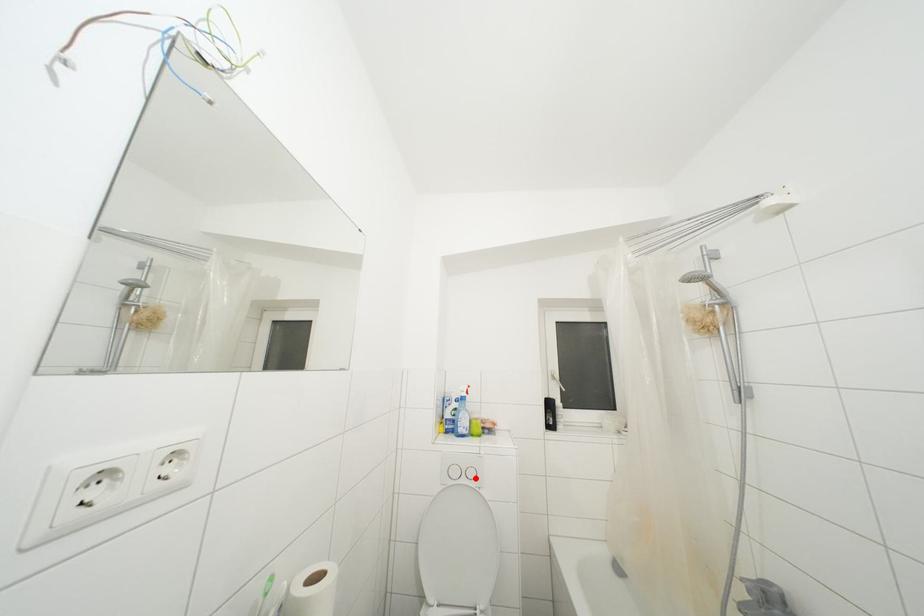
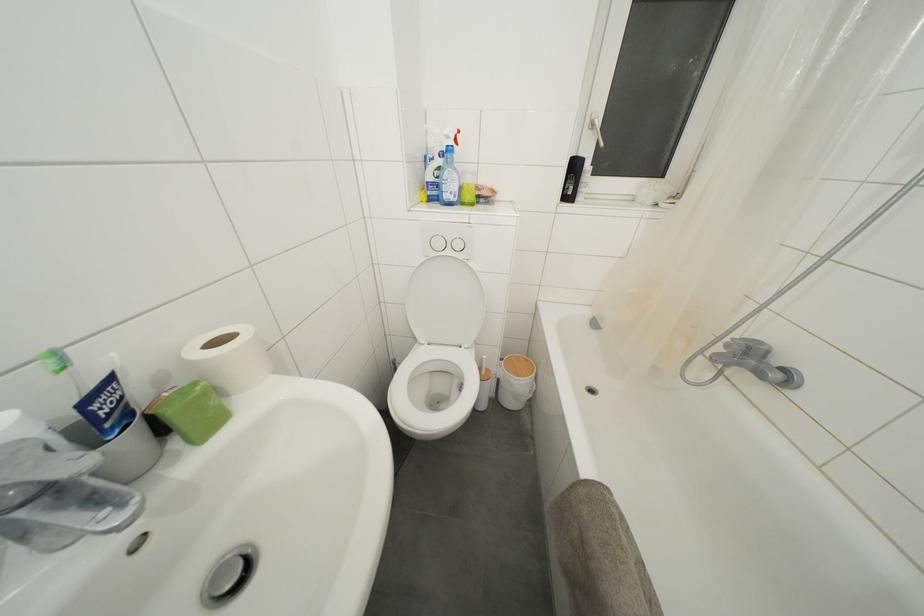
Question: I am providing you with two images of the same scene from different viewpoints. Image1 has a red point marked. In image2, the corresponding 3D location appears at what relative position? Reply with the corresponding letter.

Choices:
 (A) Closer
 (B) Farther

Answer: (A)